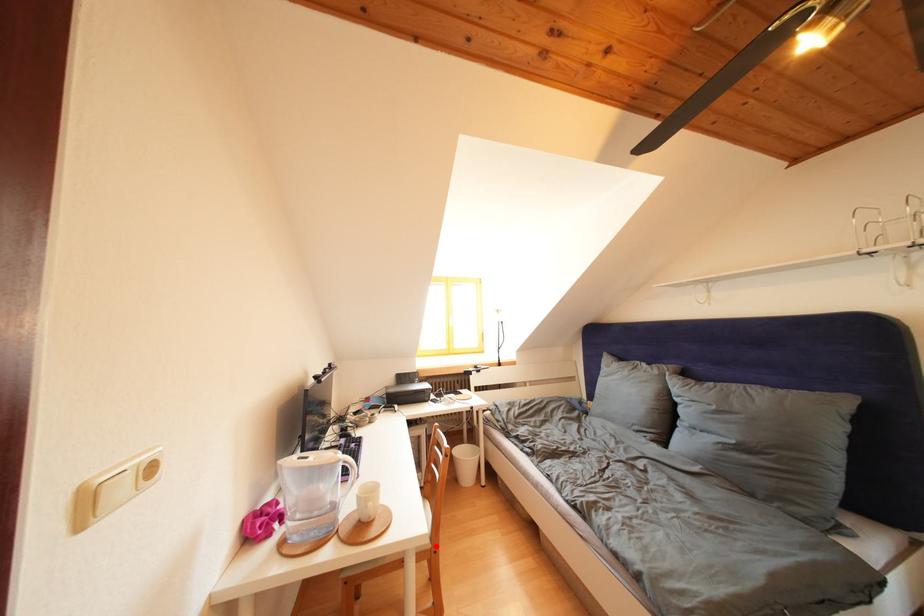
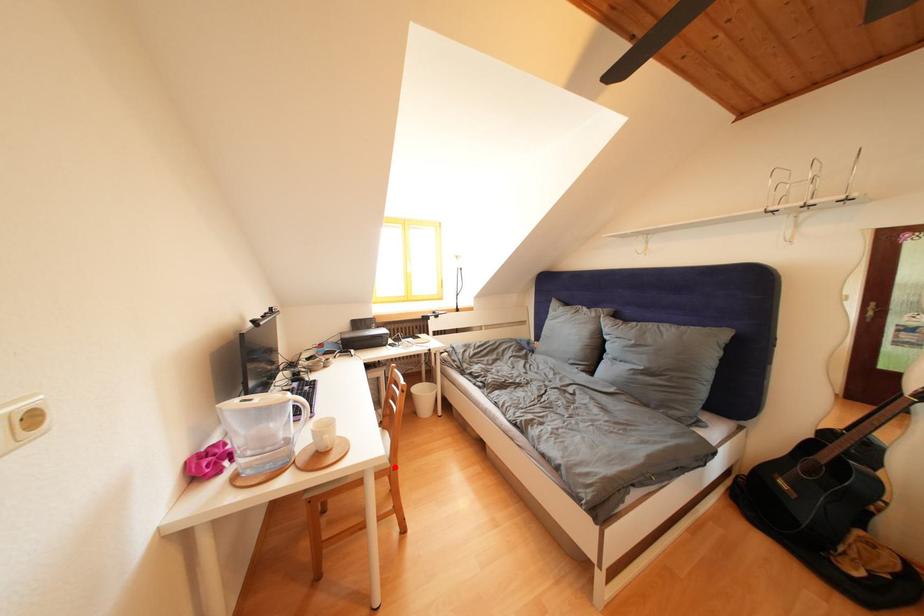
I am providing you with two images of the same scene from different viewpoints. A red point is marked on the first image and another point is marked on the second image. Do the highlighted points in image1 and image2 indicate the same real-world spot?

Yes